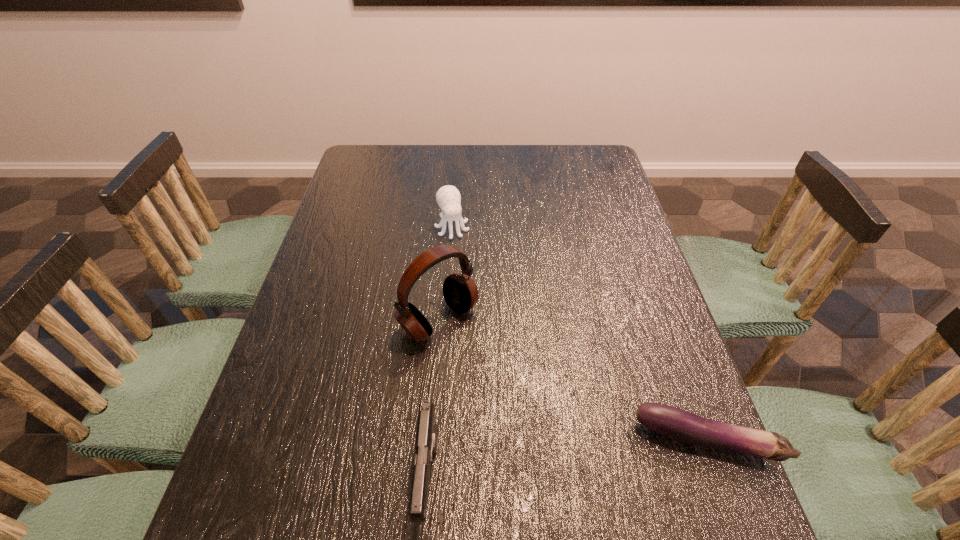
Where is `free space at the right edge of the desktop`? The height and width of the screenshot is (540, 960). free space at the right edge of the desktop is located at coordinates (607, 269).

Find the location of a particular element. vacant point at the far left corner is located at coordinates (366, 152).

Find the location of a particular element. The image size is (960, 540). vacant space at the far right corner is located at coordinates (560, 144).

Find the location of `free spot between the tallest object and the pistol`. free spot between the tallest object and the pistol is located at coordinates (434, 400).

This screenshot has height=540, width=960. Find the location of `empty location between the pistol and the eggplant`. empty location between the pistol and the eggplant is located at coordinates (567, 460).

Find the location of a particular element. This screenshot has height=540, width=960. vacant region between the pistol and the tallest object is located at coordinates (434, 400).

Identify the location of free space between the pistol and the rightmost object. (567, 460).

What are the coordinates of `vacant space in between the pistol and the farthest object` in the screenshot? It's located at (441, 354).

This screenshot has height=540, width=960. I want to click on free space between the pistol and the shortest object, so click(567, 460).

Where is `free point between the farthest object and the eggplant`? This screenshot has height=540, width=960. free point between the farthest object and the eggplant is located at coordinates (579, 334).